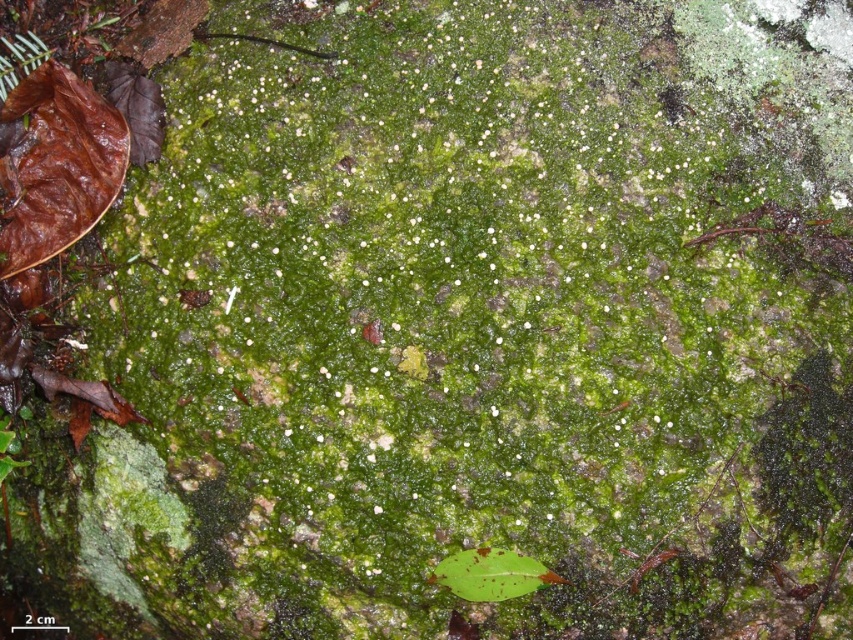
Question: Is brown matte leaf at lower left above green matte leaf at lower center?

Choices:
 (A) no
 (B) yes

Answer: (B)

Question: Which point appears closest to the camera in this image?

Choices:
 (A) (486, 596)
 (B) (51, 68)

Answer: (A)

Question: Can you confirm if brown matte leaf at lower left is smaller than green matte leaf at lower center?

Choices:
 (A) no
 (B) yes

Answer: (A)

Question: Which object appears farthest from the camera in this image?

Choices:
 (A) brown matte leaf at lower left
 (B) green matte leaf at lower center

Answer: (A)

Question: Among these points, which one is farthest from the camera?

Choices:
 (A) (474, 560)
 (B) (119, 161)

Answer: (B)

Question: Is brown matte leaf at lower left above green matte leaf at lower center?

Choices:
 (A) yes
 (B) no

Answer: (A)